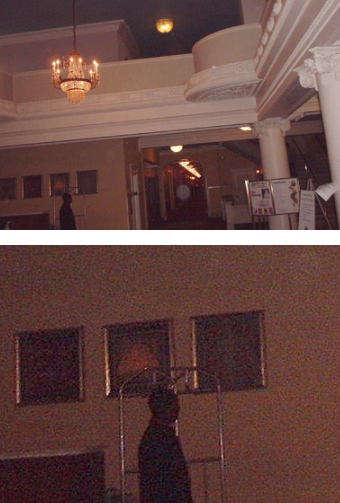
I want to click on counters/desk, so click(x=36, y=218), click(x=51, y=472).